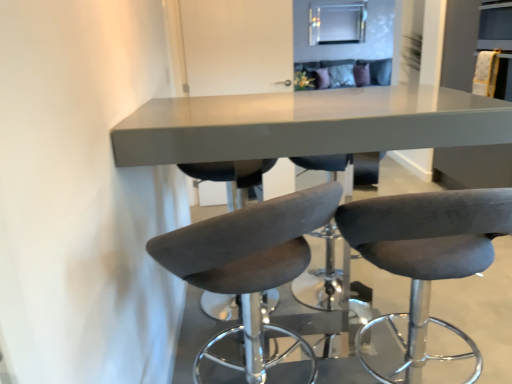
Question: From a real-world perspective, is dark gray fabric stool at center, arranged as the first chair when viewed from the right, physically located above or below suede-like gray bar stool at center, the 1th chair when ordered from left to right?

Choices:
 (A) above
 (B) below

Answer: (B)

Question: In terms of width, does dark gray fabric stool at center, arranged as the first chair when viewed from the right, look wider or thinner when compared to suede-like gray bar stool at center, which ranks as the 2th chair in right-to-left order?

Choices:
 (A) thin
 (B) wide

Answer: (A)

Question: Estimate the real-world distances between objects in this image. Which object is closer to the dark gray fabric stool at center, the 2th chair viewed from the left?

Choices:
 (A) matte gray table at center
 (B) suede-like gray bar stool at center, which ranks as the 2th chair in right-to-left order

Answer: (B)

Question: Based on their relative distances, which object is nearer to the dark gray fabric stool at center, arranged as the first chair when viewed from the right?

Choices:
 (A) matte gray table at center
 (B) suede-like gray bar stool at center, the 1th chair when ordered from left to right

Answer: (B)